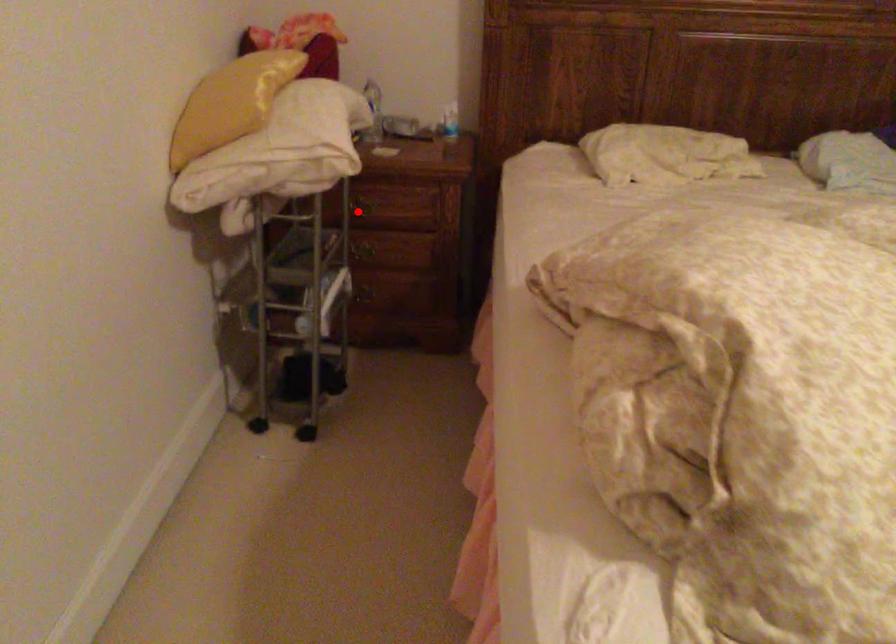
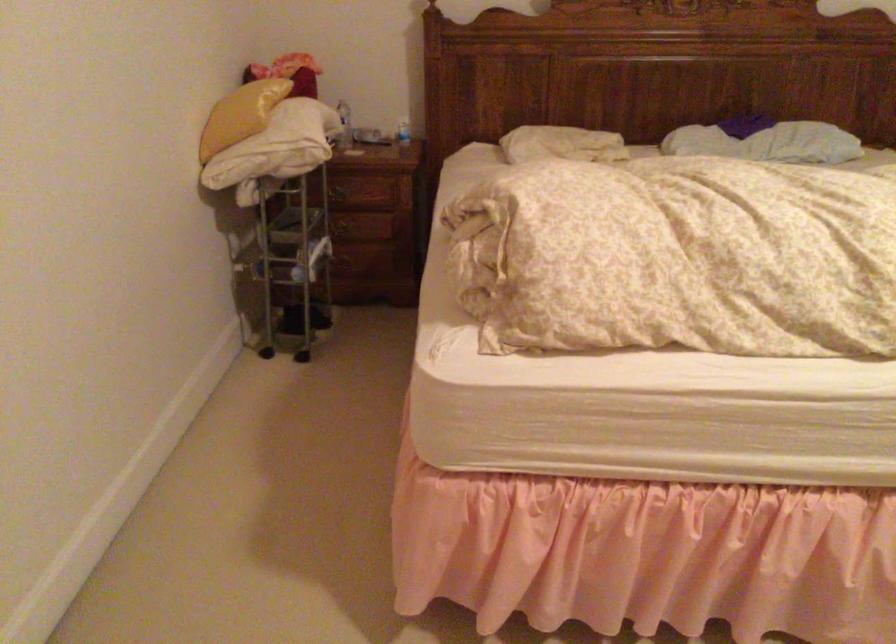
In the second image, find the point that corresponds to the highlighted location in the first image.

(338, 194)